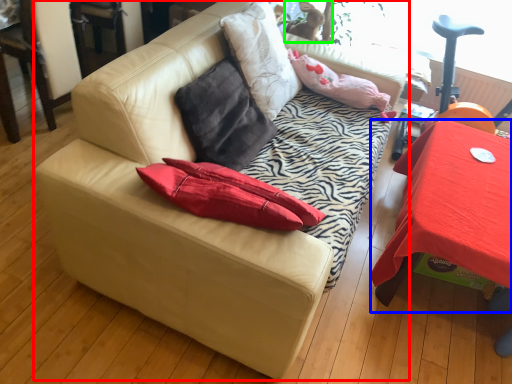
Question: Which object is positioned farthest from studio couch (highlighted by a red box)? Select from table (highlighted by a blue box) and animal (highlighted by a green box).

Choices:
 (A) table
 (B) animal

Answer: (B)